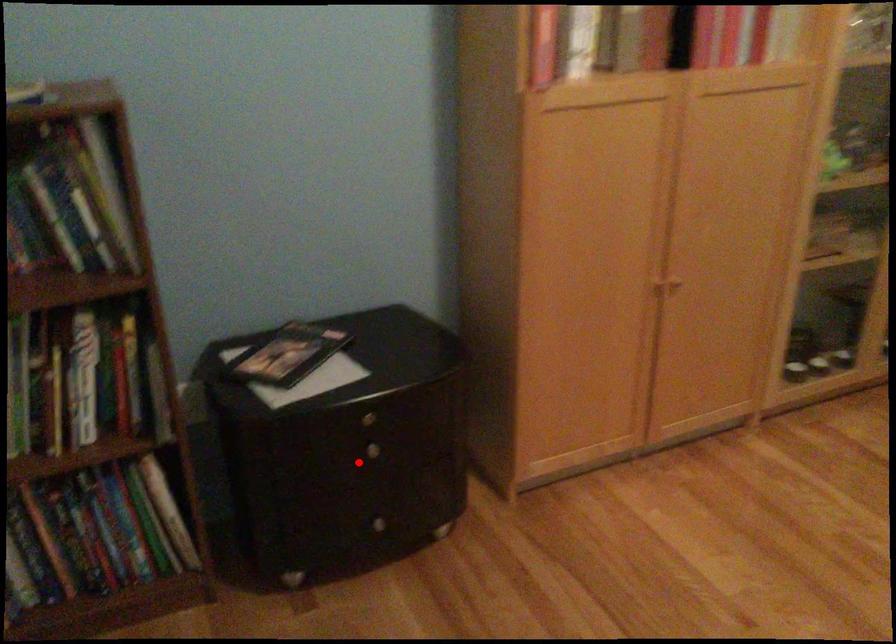
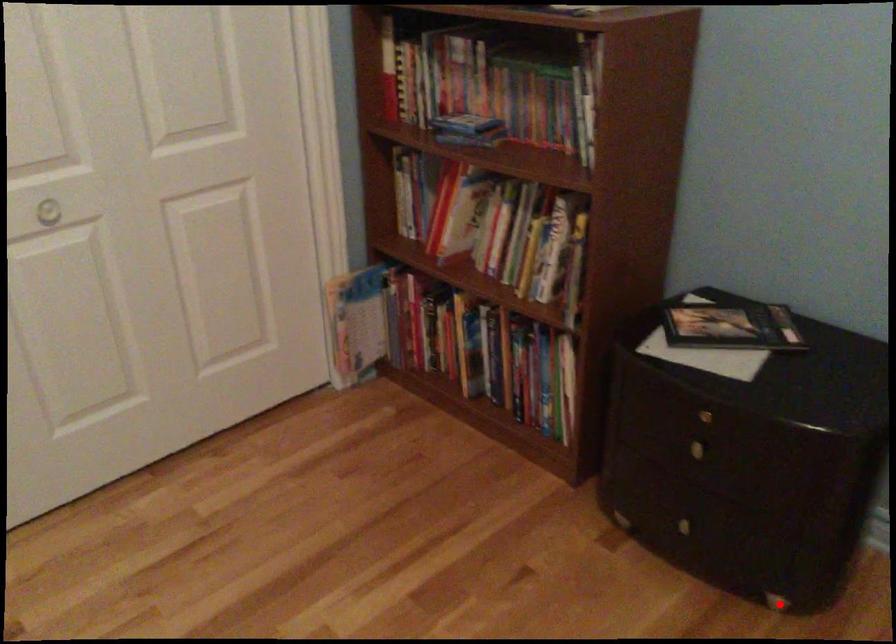
I am providing you with two images of the same scene from different viewpoints. A red point is marked on the first image and another point is marked on the second image. Does the point marked in image1 correspond to the same location as the one in image2?

No